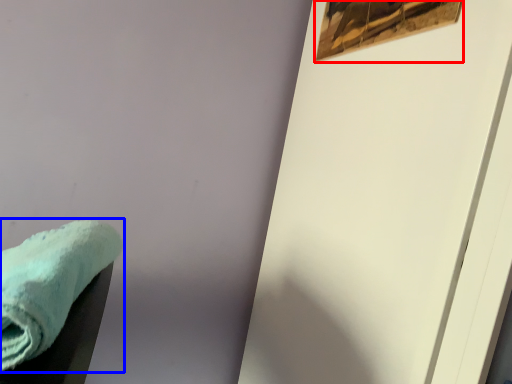
Question: Which object is closer to the camera taking this photo, picture frame (highlighted by a red box) or towel (highlighted by a blue box)?

Choices:
 (A) picture frame
 (B) towel

Answer: (B)